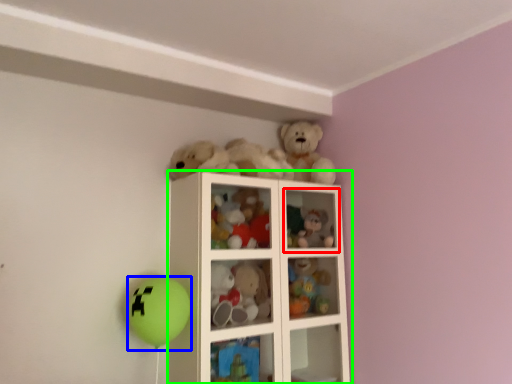
Question: Which object is the closest to the cabinet (highlighted by a red box)? Choose among these: balloon (highlighted by a blue box) or shelf (highlighted by a green box).

Choices:
 (A) balloon
 (B) shelf

Answer: (B)